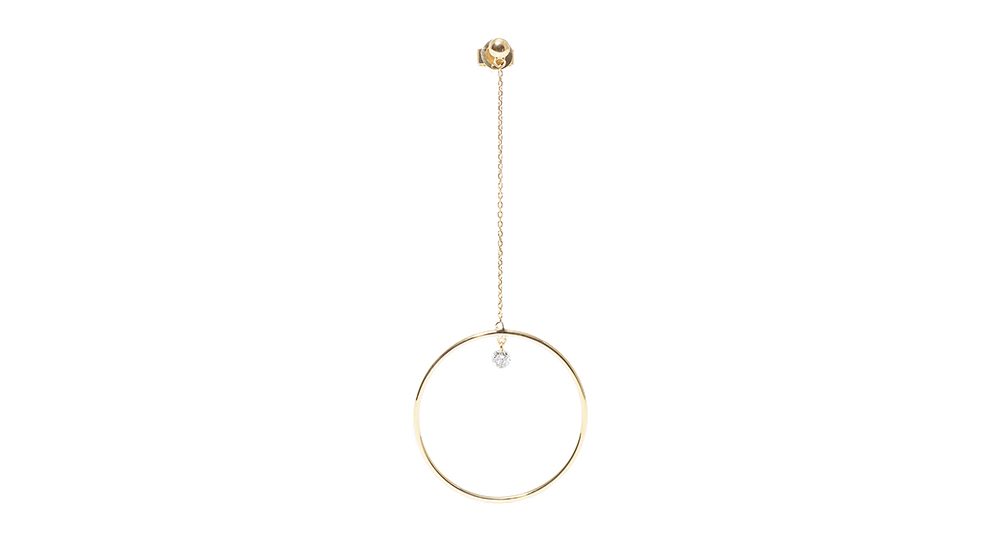
I want to click on knob, so click(492, 42).